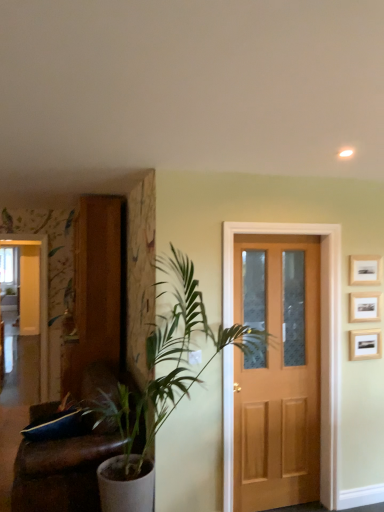
The width and height of the screenshot is (384, 512). What are the coordinates of `brown leather couch at left` in the screenshot? It's located at (62, 472).

This screenshot has height=512, width=384. Identify the location of wooden picture frame at upper right, the 1th picture frame when ordered from top to bottom. (364, 270).

What do you see at coordinates (277, 373) in the screenshot?
I see `light brown wood door at center` at bounding box center [277, 373].

The width and height of the screenshot is (384, 512). What do you see at coordinates (169, 361) in the screenshot?
I see `green leafy plant at left` at bounding box center [169, 361].

Find the location of a particular element. The width and height of the screenshot is (384, 512). brown leather couch at left is located at coordinates (62, 472).

Is wooden picture frame at upper right, placed as the second picture frame when sorted from top to bottom, not close to brown leather couch at left?

wooden picture frame at upper right, placed as the second picture frame when sorted from top to bottom, is positioned a significant distance from brown leather couch at left.

Between wooden picture frame at upper right, placed as the second picture frame when sorted from top to bottom, and brown leather couch at left, which one has less height?

With less height is wooden picture frame at upper right, placed as the second picture frame when sorted from top to bottom.

Where is `furniture on the left of wooden picture frame at upper right, which ranks as the 2th picture frame in bottom-to-top order`? This screenshot has height=512, width=384. furniture on the left of wooden picture frame at upper right, which ranks as the 2th picture frame in bottom-to-top order is located at coordinates (62, 472).

Is wooden picture frame at upper right, which ranks as the 2th picture frame in bottom-to-top order, looking in the opposite direction of brown leather couch at left?

No, wooden picture frame at upper right, which ranks as the 2th picture frame in bottom-to-top order, is not facing away from brown leather couch at left.

How different are the orientations of wooden picture frame at upper right, which ranks as the 2th picture frame in bottom-to-top order, and green leafy plant at left in degrees?

wooden picture frame at upper right, which ranks as the 2th picture frame in bottom-to-top order, and green leafy plant at left are facing 83.7 degrees away from each other.

Is wooden picture frame at upper right, which ranks as the 2th picture frame in bottom-to-top order, shorter than green leafy plant at left?

Yes, wooden picture frame at upper right, which ranks as the 2th picture frame in bottom-to-top order, is shorter than green leafy plant at left.

Does point (372, 315) come farther from viewer compared to point (178, 378)?

Yes, point (372, 315) is behind point (178, 378).

From the image's perspective, relative to green leafy plant at left, is wooden picture frame at upper right, placed as the second picture frame when sorted from top to bottom, above or below?

wooden picture frame at upper right, placed as the second picture frame when sorted from top to bottom, is above green leafy plant at left.

Considering the sizes of brown leather couch at left and wooden picture frame at upper right, the 1th picture frame when ordered from top to bottom, in the image, is brown leather couch at left bigger or smaller than wooden picture frame at upper right, the 1th picture frame when ordered from top to bottom,?

Considering their sizes, brown leather couch at left takes up more space than wooden picture frame at upper right, the 1th picture frame when ordered from top to bottom.

Is brown leather couch at left not near wooden picture frame at upper right, the 1th picture frame when ordered from top to bottom?

Yes, brown leather couch at left and wooden picture frame at upper right, the 1th picture frame when ordered from top to bottom, are located far from each other.

Is brown leather couch at left at the left side of wooden picture frame at upper right, the 1th picture frame when ordered from top to bottom?

Yes.

How far apart are light brown wood door at center and white glossy elevator at left?

A distance of 1.93 meters exists between light brown wood door at center and white glossy elevator at left.

From a real-world perspective, does light brown wood door at center sit lower than white glossy elevator at left?

Yes.

Is light brown wood door at center wider or thinner than white glossy elevator at left?

Considering their sizes, light brown wood door at center looks slimmer than white glossy elevator at left.

Is point (246, 508) closer or farther from the camera than point (41, 349)?

Clearly, point (246, 508) is closer to the camera than point (41, 349).

Which is more to the left, white glossy elevator at left or green leafy plant at left?

Positioned to the left is white glossy elevator at left.

Is point (41, 320) less distant than point (141, 429)?

No, it is behind (141, 429).

Is white glossy elevator at left touching green leafy plant at left?

white glossy elevator at left is not next to green leafy plant at left, and they're not touching.

Does white glossy elevator at left contain green leafy plant at left?

No, green leafy plant at left is not a part of white glossy elevator at left.

From the image's perspective, does wooden picture frame at upper right, which ranks as the 2th picture frame in bottom-to-top order, appear higher than wooden picture frame at upper right, the 1th picture frame when ordered from top to bottom?

No, from the image's perspective, wooden picture frame at upper right, which ranks as the 2th picture frame in bottom-to-top order, is not above wooden picture frame at upper right, the 1th picture frame when ordered from top to bottom.

Considering the relative positions of wooden picture frame at upper right, placed as the second picture frame when sorted from top to bottom, and wooden picture frame at upper right, the 3th picture frame from the bottom, in the image provided, is wooden picture frame at upper right, placed as the second picture frame when sorted from top to bottom, to the left or to the right of wooden picture frame at upper right, the 3th picture frame from the bottom,?

In the image, wooden picture frame at upper right, placed as the second picture frame when sorted from top to bottom, appears on the left side of wooden picture frame at upper right, the 3th picture frame from the bottom.

From a real-world perspective, is wooden picture frame at upper right, placed as the second picture frame when sorted from top to bottom, physically below wooden picture frame at upper right, the 1th picture frame when ordered from top to bottom?

Yes, from a real-world perspective, wooden picture frame at upper right, placed as the second picture frame when sorted from top to bottom, is below wooden picture frame at upper right, the 1th picture frame when ordered from top to bottom.

Considering the relative sizes of wooden picture frame at upper right, placed as the second picture frame when sorted from top to bottom, and wooden picture frame at upper right, the 3th picture frame from the bottom, in the image provided, is wooden picture frame at upper right, placed as the second picture frame when sorted from top to bottom, thinner than wooden picture frame at upper right, the 3th picture frame from the bottom,?

No.

Would you say green leafy plant at left is part of wooden picture frame at upper right, the 3th picture frame from the bottom,'s contents?

No, green leafy plant at left is located outside of wooden picture frame at upper right, the 3th picture frame from the bottom.

Visually, is wooden picture frame at upper right, the 3th picture frame from the bottom, positioned to the left or to the right of green leafy plant at left?

wooden picture frame at upper right, the 3th picture frame from the bottom, is to the right of green leafy plant at left.

Measure the distance from wooden picture frame at upper right, the 1th picture frame when ordered from top to bottom, to green leafy plant at left.

wooden picture frame at upper right, the 1th picture frame when ordered from top to bottom, is 1.41 meters away from green leafy plant at left.

Is wooden picture frame at upper right, the 3th picture frame from the bottom, not close to green leafy plant at left?

Absolutely, wooden picture frame at upper right, the 3th picture frame from the bottom, is distant from green leafy plant at left.

At what (x,y) coordinates should I click in order to perform the action: click on picture frame that is the 3rd one when counting backward from the brown leather couch at left. Please return your answer as a coordinate pair (x, y). Looking at the image, I should click on (364, 307).

From the image's perspective, count 2nd picture frames upward from the green leafy plant at left and point to it. Please provide its 2D coordinates.

[(364, 307)]

When comparing their distances from brown leather couch at left, does wooden picture frame at upper right, the 3th picture frame viewed from the top, or light brown wood door at center seem closer?

light brown wood door at center is positioned closer to the anchor brown leather couch at left.

When comparing their distances from wooden picture frame at upper right, placed as the second picture frame when sorted from top to bottom, does green leafy plant at left or white glossy elevator at left seem further?

The object further to wooden picture frame at upper right, placed as the second picture frame when sorted from top to bottom, is white glossy elevator at left.

Which object lies further to the anchor point green leafy plant at left, light brown wood door at center or wooden picture frame at upper right, the 1th picture frame when ordered from top to bottom?

wooden picture frame at upper right, the 1th picture frame when ordered from top to bottom, is positioned further to the anchor green leafy plant at left.

When comparing their distances from white glossy elevator at left, does wooden picture frame at upper right, arranged as the first picture frame when ordered from the bottom, or wooden picture frame at upper right, the 3th picture frame from the bottom, seem closer?

Based on the image, wooden picture frame at upper right, the 3th picture frame from the bottom, appears to be nearer to white glossy elevator at left.

When comparing their distances from wooden picture frame at upper right, placed as the second picture frame when sorted from top to bottom, does light brown wood door at center or green leafy plant at left seem closer?

light brown wood door at center.

Looking at the image, which one is located closer to white glossy elevator at left, wooden picture frame at upper right, the 1th picture frame when ordered from top to bottom, or wooden picture frame at upper right, which ranks as the 2th picture frame in bottom-to-top order?

wooden picture frame at upper right, the 1th picture frame when ordered from top to bottom, lies closer to white glossy elevator at left than the other object.

When comparing their distances from green leafy plant at left, does light brown wood door at center or white glossy elevator at left seem closer?

light brown wood door at center.

Based on their spatial positions, is light brown wood door at center or wooden picture frame at upper right, the 3th picture frame viewed from the top, further from white glossy elevator at left?

wooden picture frame at upper right, the 3th picture frame viewed from the top, is further to white glossy elevator at left.

Where is `picture frame between white glossy elevator at left and wooden picture frame at upper right, which ranks as the 2th picture frame in bottom-to-top order`? picture frame between white glossy elevator at left and wooden picture frame at upper right, which ranks as the 2th picture frame in bottom-to-top order is located at coordinates (365, 344).

What are the coordinates of `screen door between green leafy plant at left and wooden picture frame at upper right, arranged as the first picture frame when ordered from the bottom` in the screenshot? It's located at (277, 373).

Identify the location of houseplant located between brown leather couch at left and wooden picture frame at upper right, the 3th picture frame viewed from the top, in the left-right direction. The image size is (384, 512). (169, 361).

The image size is (384, 512). I want to click on furniture between white glossy elevator at left and light brown wood door at center in the horizontal direction, so click(x=62, y=472).